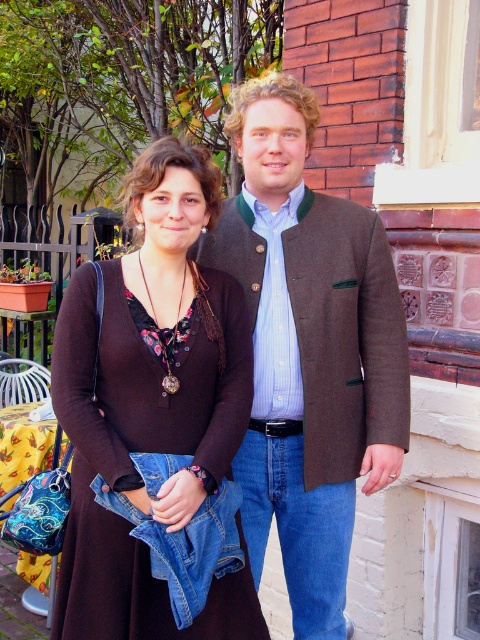
Question: Which point is farther from the camera taking this photo?

Choices:
 (A) (314, 540)
 (B) (115, 616)

Answer: (A)

Question: Does brown woolen jacket at center have a greater width compared to brown fabric dress at center?

Choices:
 (A) yes
 (B) no

Answer: (A)

Question: Which object appears farthest from the camera in this image?

Choices:
 (A) brown woolen jacket at center
 (B) brown fabric dress at center

Answer: (A)

Question: Can you confirm if brown woolen jacket at center is positioned below brown fabric dress at center?

Choices:
 (A) yes
 (B) no

Answer: (B)

Question: Can you confirm if brown woolen jacket at center is thinner than brown fabric dress at center?

Choices:
 (A) yes
 (B) no

Answer: (B)

Question: Which object is closer to the camera taking this photo?

Choices:
 (A) brown fabric dress at center
 (B) brown woolen jacket at center

Answer: (A)